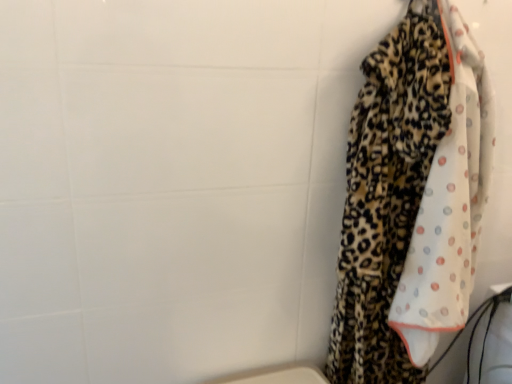
This screenshot has width=512, height=384. Describe the element at coordinates (412, 198) in the screenshot. I see `leopard print towel at right` at that location.

The image size is (512, 384). I want to click on leopard print towel at right, so click(x=412, y=198).

Locate an element on the screen. The width and height of the screenshot is (512, 384). leopard print towel at right is located at coordinates [x=412, y=198].